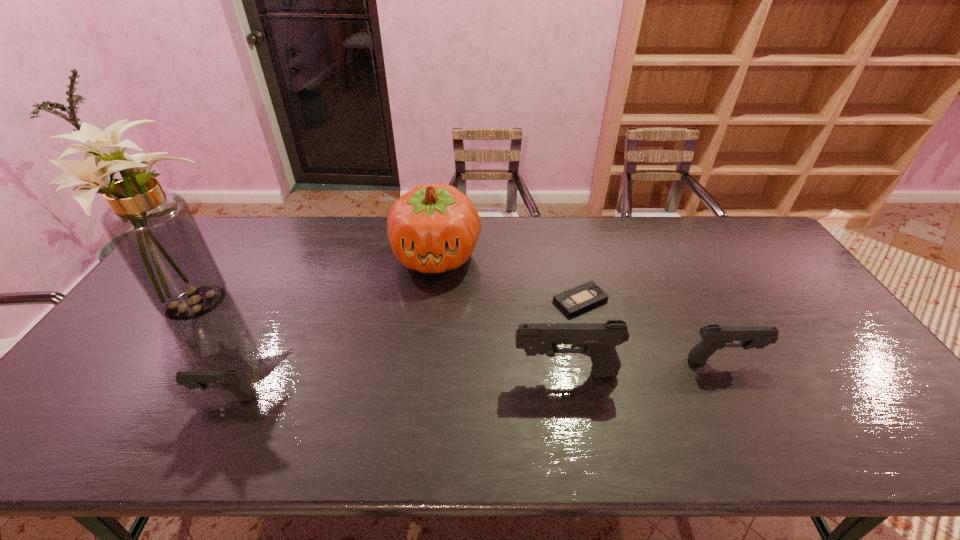
Where is `empty space that is in between the second tallest pistol and the tallest pistol`? This screenshot has height=540, width=960. empty space that is in between the second tallest pistol and the tallest pistol is located at coordinates (644, 367).

The image size is (960, 540). I want to click on free spot between the third nearest object and the leftmost pistol, so click(x=473, y=380).

Image resolution: width=960 pixels, height=540 pixels. Find the location of `free space between the second nearest pistol and the flower arrangement`. free space between the second nearest pistol and the flower arrangement is located at coordinates (380, 340).

I want to click on vacant space in between the farthest pistol and the leftmost object, so click(459, 334).

I want to click on free space between the flower arrangement and the second nearest object, so click(380, 340).

Image resolution: width=960 pixels, height=540 pixels. I want to click on free space between the third shortest object and the leftmost object, so click(459, 334).

I want to click on free space between the leftmost object and the leftmost pistol, so click(x=209, y=353).

At what (x,y) coordinates should I click in order to perform the action: click on vacant space that is in between the tallest object and the videotape. Please return your answer as a coordinate pair (x, y). This screenshot has width=960, height=540. Looking at the image, I should click on (x=388, y=304).

This screenshot has width=960, height=540. What are the coordinates of `object that is the fourth closest to the leftmost object` in the screenshot? It's located at (573, 301).

In order to click on the fifth closest object to the third object from left to right in this screenshot , I will do `click(714, 337)`.